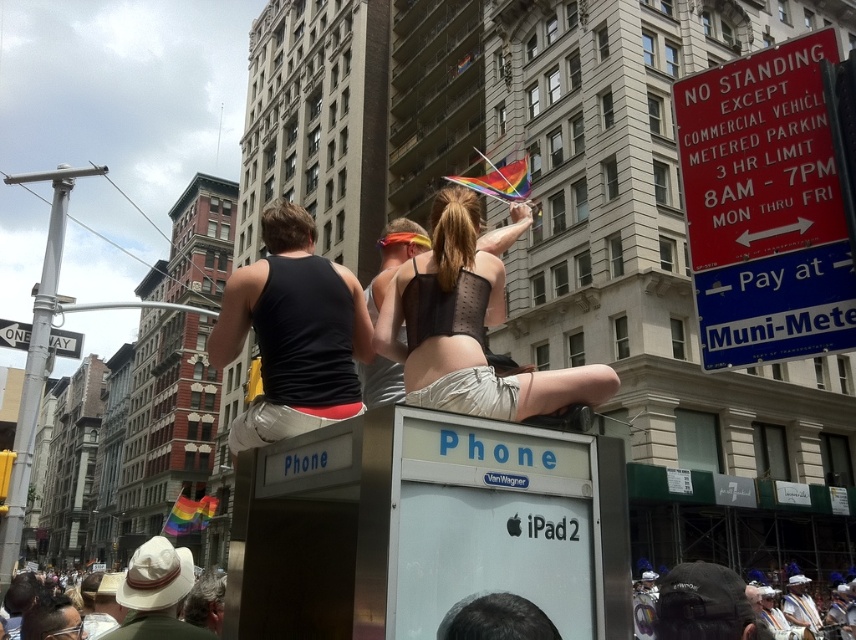
In the scene shown: Between black mesh top at center and black matte tank top at center, which one appears on the left side from the viewer's perspective?

black matte tank top at center is more to the left.

Can you confirm if black mesh top at center is taller than black matte tank top at center?

No, black mesh top at center is not taller than black matte tank top at center.

Between point (498, 289) and point (215, 353), which one is positioned behind?

Point (215, 353)

Locate an element on the screen. black mesh top at center is located at coordinates (468, 330).

Does black matte tank top at center have a greater width compared to white cotton hat at lower center?

Yes.

Does point (349, 336) come in front of point (798, 616)?

Yes, point (349, 336) is in front of point (798, 616).

Between point (282, 300) and point (800, 592), which one is positioned behind?

Positioned behind is point (800, 592).

In order to click on black matte tank top at center in this screenshot , I will do `click(293, 332)`.

At what (x,y) coordinates should I click in order to perform the action: click on black mesh top at center. Please return your answer as a coordinate pair (x, y). The width and height of the screenshot is (856, 640). Looking at the image, I should click on (468, 330).

Is black mesh top at center wider than matte black tank top at center?

Incorrect, black mesh top at center's width does not surpass matte black tank top at center's.

I want to click on black mesh top at center, so click(468, 330).